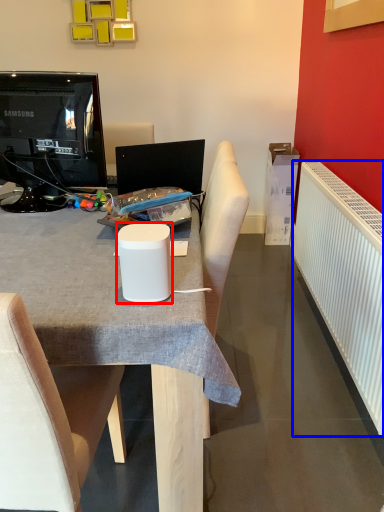
Question: Which of the following is the farthest to the observer, paper cup (highlighted by a red box) or radiator (highlighted by a blue box)?

Choices:
 (A) paper cup
 (B) radiator

Answer: (B)